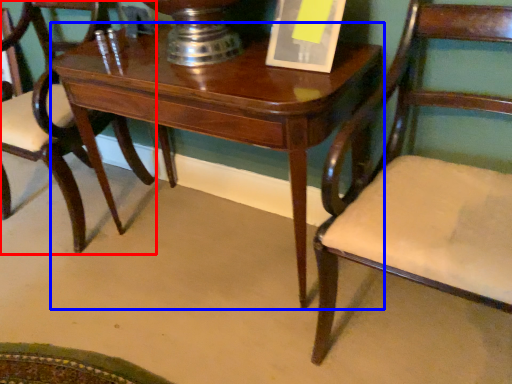
Question: Among these objects, which one is nearest to the camera, chair (highlighted by a red box) or table (highlighted by a blue box)?

Choices:
 (A) chair
 (B) table

Answer: (B)